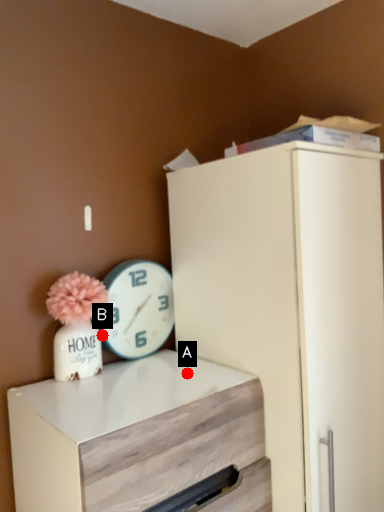
Question: Two points are circled on the image, labeled by A and B beside each circle. Which point is closer to the camera taking this photo?

Choices:
 (A) A is closer
 (B) B is closer

Answer: (A)